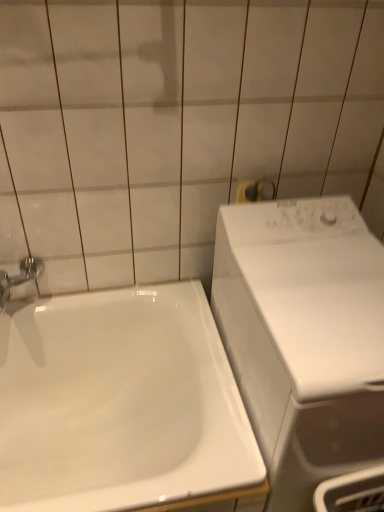
What is the approximate width of chrome metallic faucet at left?

chrome metallic faucet at left is 7.14 inches wide.

Describe the element at coordinates (19, 277) in the screenshot. I see `chrome metallic faucet at left` at that location.

Locate an element on the screen. The height and width of the screenshot is (512, 384). white glossy sink at lower left is located at coordinates (123, 406).

The width and height of the screenshot is (384, 512). I want to click on white glossy washing machine at right, so click(x=304, y=337).

Considering the relative positions of white glossy washing machine at right and white glossy sink at lower left in the image provided, is white glossy washing machine at right to the left or to the right of white glossy sink at lower left?

Based on their positions, white glossy washing machine at right is located to the right of white glossy sink at lower left.

Which object is more forward, white glossy washing machine at right or white glossy sink at lower left?

white glossy washing machine at right is in front.

Can you tell me how much white glossy washing machine at right and white glossy sink at lower left differ in facing direction?

The angle between the facing direction of white glossy washing machine at right and the facing direction of white glossy sink at lower left is 0.706 degrees.

Does point (255, 361) appear closer or farther from the camera than point (170, 478)?

Point (255, 361) appears to be farther away from the viewer than point (170, 478).

From a real-world perspective, is chrome metallic faucet at left beneath white glossy sink at lower left?

No, from a real-world perspective, chrome metallic faucet at left is not beneath white glossy sink at lower left.

From the image's perspective, does chrome metallic faucet at left appear higher than white glossy sink at lower left?

Yes.

Considering the sizes of objects chrome metallic faucet at left and white glossy sink at lower left in the image provided, who is thinner, chrome metallic faucet at left or white glossy sink at lower left?

chrome metallic faucet at left is thinner.

Is point (2, 270) positioned behind point (32, 457)?

No, (2, 270) is closer to viewer.

Between white glossy washing machine at right and chrome metallic faucet at left, which one appears on the right side from the viewer's perspective?

white glossy washing machine at right.

Does white glossy washing machine at right have a larger size compared to chrome metallic faucet at left?

Yes, white glossy washing machine at right is bigger than chrome metallic faucet at left.

From the image's perspective, is white glossy washing machine at right positioned above or below chrome metallic faucet at left?

From the image's perspective, white glossy washing machine at right appears below chrome metallic faucet at left.

Would you consider white glossy washing machine at right to be distant from chrome metallic faucet at left?

No, there isn't a large distance between white glossy washing machine at right and chrome metallic faucet at left.

Considering the relative positions of white glossy sink at lower left and chrome metallic faucet at left in the image provided, is white glossy sink at lower left to the right of chrome metallic faucet at left from the viewer's perspective?

Yes, white glossy sink at lower left is to the right of chrome metallic faucet at left.

You are a GUI agent. You are given a task and a screenshot of the screen. Output one action in this format:
    pyautogui.click(x=<x>, y=<y>)
    Task: Click on the sink below the chrome metallic faucet at left (from a real-world perspective)
    
    Given the screenshot: What is the action you would take?
    pyautogui.click(x=123, y=406)

What's the angular difference between white glossy sink at lower left and chrome metallic faucet at left's facing directions?

The angle between the facing direction of white glossy sink at lower left and the facing direction of chrome metallic faucet at left is 0.0427 degrees.

From a real-world perspective, who is located higher, white glossy sink at lower left or chrome metallic faucet at left?

In real-world perspective, chrome metallic faucet at left is above.

Is white glossy sink at lower left in front of or behind white glossy washing machine at right in the image?

white glossy sink at lower left is positioned farther from the viewer than white glossy washing machine at right.

From a real-world perspective, who is located higher, white glossy sink at lower left or white glossy washing machine at right?

white glossy washing machine at right, from a real-world perspective.

From the image's perspective, which is above, white glossy sink at lower left or white glossy washing machine at right?

white glossy washing machine at right appears higher in the image.

Find the location of a particular element. tap that appears above the white glossy washing machine at right (from a real-world perspective) is located at coordinates (19, 277).

Which of these two, chrome metallic faucet at left or white glossy washing machine at right, is thinner?

chrome metallic faucet at left.

Choose the correct answer: Is chrome metallic faucet at left inside white glossy washing machine at right or outside it?

chrome metallic faucet at left is not inside white glossy washing machine at right, it's outside.

Identify the location of washing machine in front of the white glossy sink at lower left. Image resolution: width=384 pixels, height=512 pixels. (304, 337).

Where is `tap located above the white glossy sink at lower left (from the image's perspective)`? This screenshot has height=512, width=384. tap located above the white glossy sink at lower left (from the image's perspective) is located at coordinates (19, 277).

When comparing their distances from white glossy washing machine at right, does chrome metallic faucet at left or white glossy sink at lower left seem further?

chrome metallic faucet at left is positioned further to the anchor white glossy washing machine at right.

When comparing their distances from white glossy washing machine at right, does white glossy sink at lower left or chrome metallic faucet at left seem closer?

The object closer to white glossy washing machine at right is white glossy sink at lower left.

From the image, which object appears to be farther from white glossy sink at lower left, chrome metallic faucet at left or white glossy washing machine at right?

Among the two, chrome metallic faucet at left is located further to white glossy sink at lower left.

Estimate the real-world distances between objects in this image. Which object is closer to chrome metallic faucet at left, white glossy sink at lower left or white glossy washing machine at right?

Among the two, white glossy sink at lower left is located nearer to chrome metallic faucet at left.

Looking at the image, which one is located further to chrome metallic faucet at left, white glossy washing machine at right or white glossy sink at lower left?

The object further to chrome metallic faucet at left is white glossy washing machine at right.

Looking at this image, estimate the real-world distances between objects in this image. Which object is further from white glossy sink at lower left, white glossy washing machine at right or chrome metallic faucet at left?

chrome metallic faucet at left.

At what (x,y) coordinates should I click in order to perform the action: click on sink located between chrome metallic faucet at left and white glossy washing machine at right in the left-right direction. Please return your answer as a coordinate pair (x, y). The height and width of the screenshot is (512, 384). Looking at the image, I should click on (123, 406).